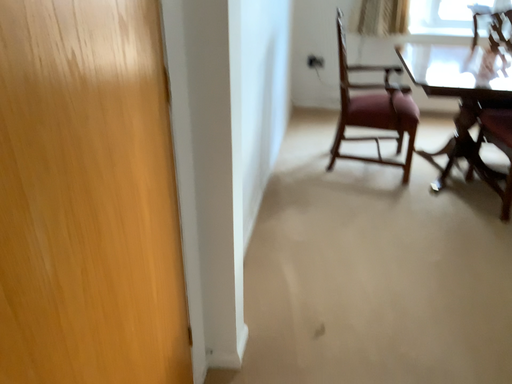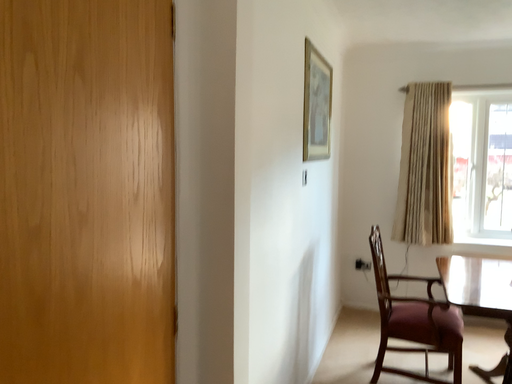
Question: Which way did the camera rotate in the video?

Choices:
 (A) rotated upward
 (B) rotated downward

Answer: (A)